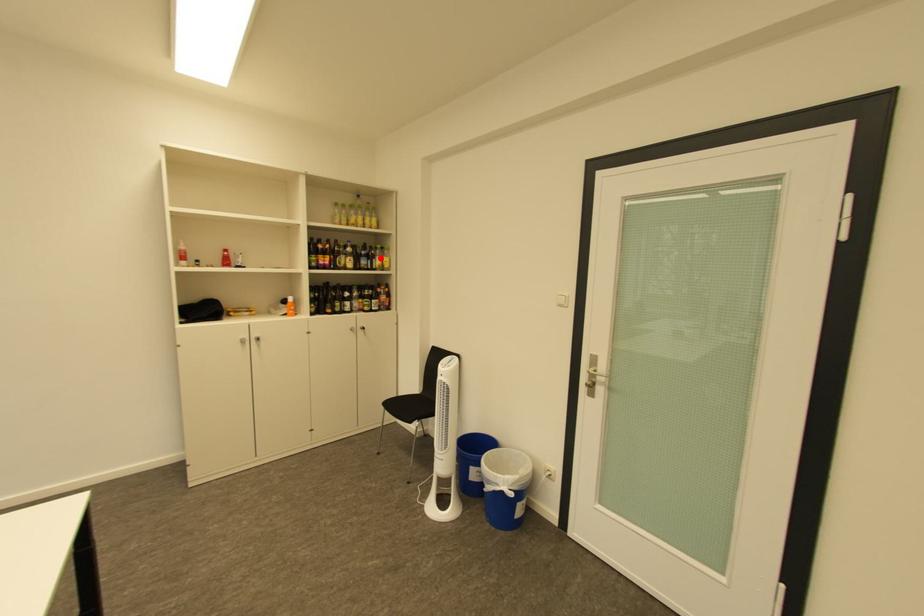
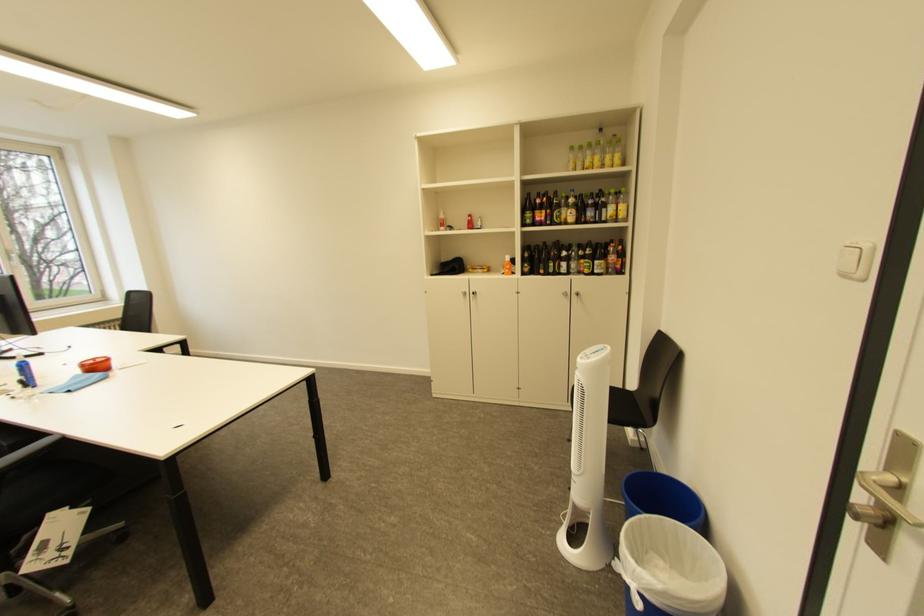
In the second image, find the point that corresponds to the highlighted location in the first image.

(610, 208)